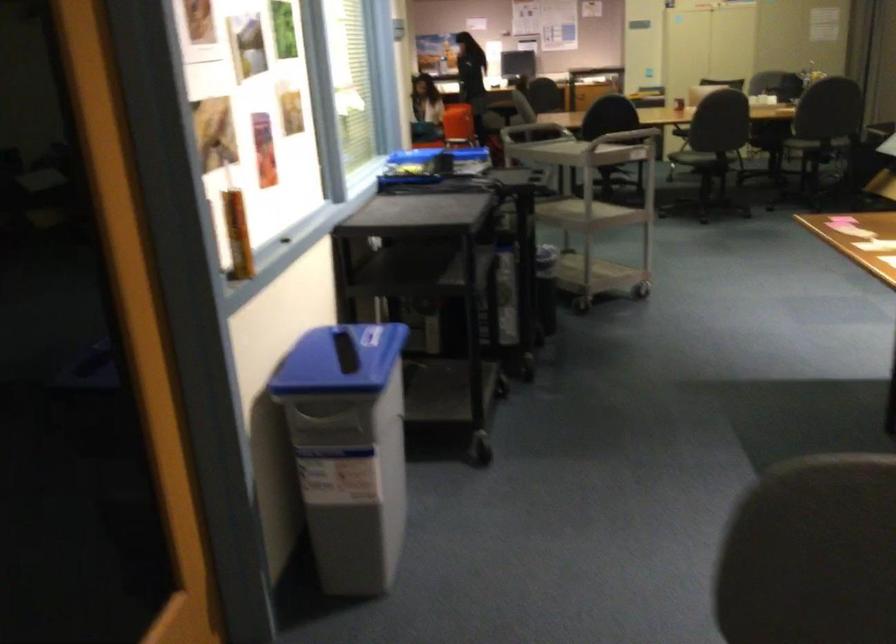
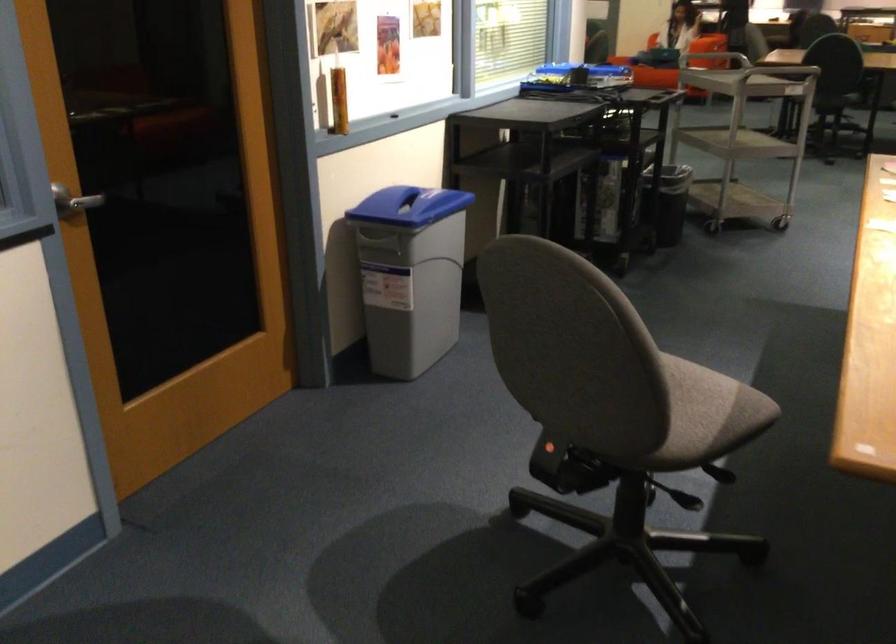
Locate, in the second image, the point that corresponds to (x=329, y=361) in the first image.

(409, 205)